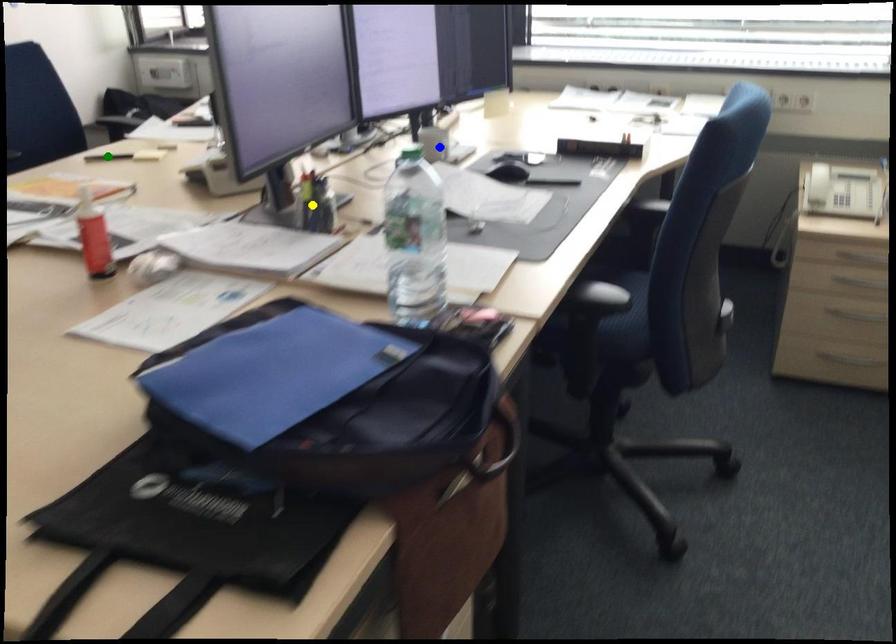
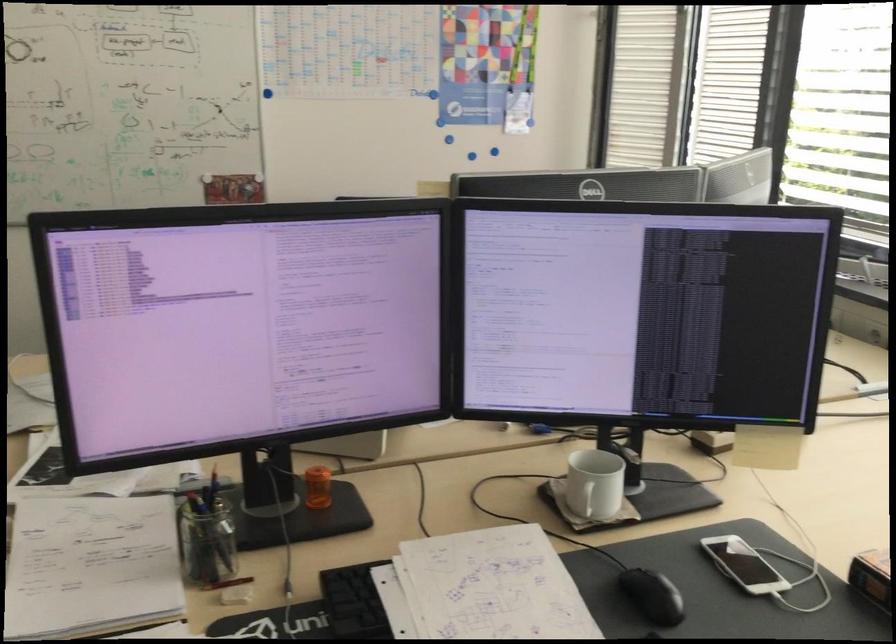
I am providing you with two images of the same scene from different viewpoints. Three points are marked in image1. Which point corresponds to a part or object that is occluded in image2?In image1, three points are marked. Which of them correspond to a part or object that is occluded in image2?Among the three points shown in image1, which one corresponds to a part or object that is no longer visible due to occlusion in image2?

green point cannot be seen in image2.